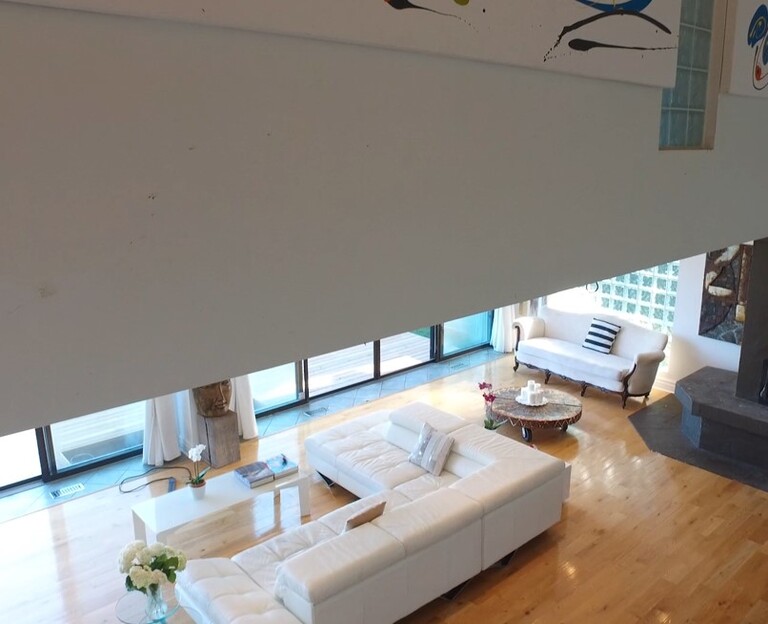
Identify the location of vase of flowers. (141, 586).